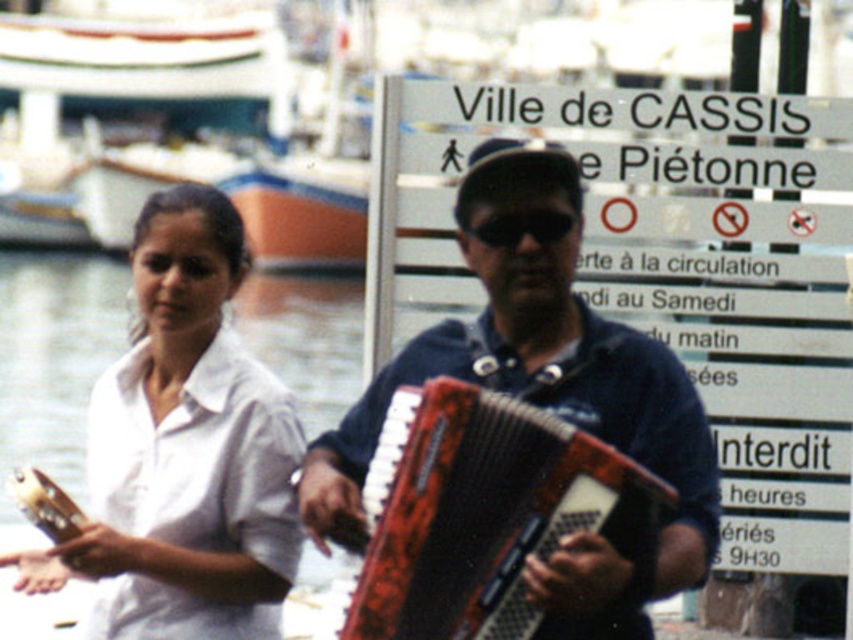
You are a photographer aiming to capture a photo of the waterfront scene. You want to ensure the white matte shirt at upper left is visible in the frame. Given its coordinates at point 0.706, 0.216, can you confirm if it will be within the camera frame?

The white matte shirt at upper left is located at point (183, 451), which falls within the standard camera frame coordinates, so it will be visible in the photo.

You are a photographer trying to capture both the white matte shirt at upper left and the black matte sunglasses at center in a single frame. Based on their sizes in the image, which object should you prioritize keeping centered to ensure it remains visible if the camera slightly drifts upwards?

The white matte shirt at upper left is larger in size compared to the black matte sunglasses at center, so prioritizing the white matte shirt at upper left would be better to ensure visibility if the camera drifts upwards.

You are a photographer trying to capture a closeup of the black matte sunglasses at center. You need to position your camera so that the rusty metal accordion at center is visible just to the left of the sunglasses in the frame. Is this possible given their current positions?

Yes, since the rusty metal accordion at center is already positioned to the left of black matte sunglasses at center, you can frame the shot so that the accordion appears to the left of the sunglasses in the image.